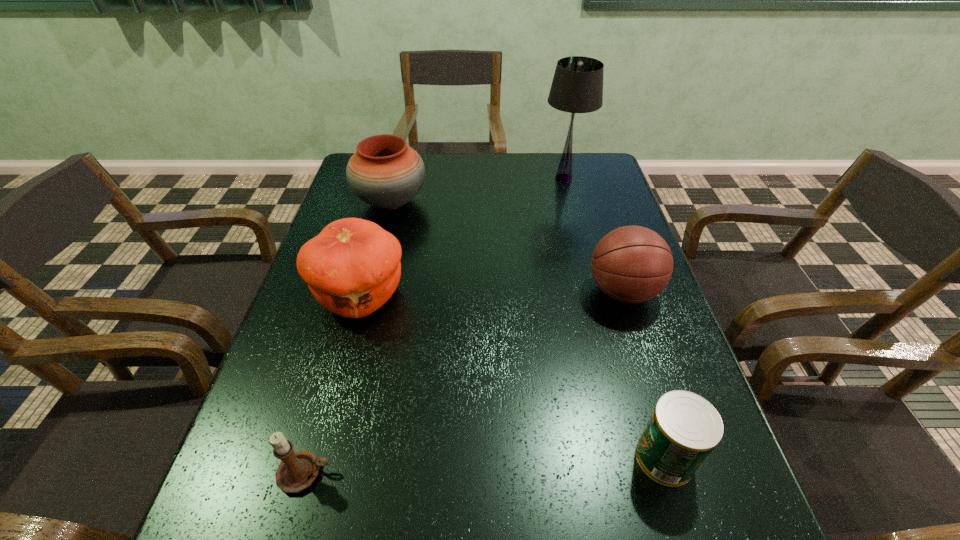
Locate an element on the screen. This screenshot has width=960, height=540. lampshade is located at coordinates (577, 87).

Where is `pumpkin`? The image size is (960, 540). pumpkin is located at coordinates (352, 268).

The height and width of the screenshot is (540, 960). What are the coordinates of `pottery` in the screenshot? It's located at point(384,172).

Image resolution: width=960 pixels, height=540 pixels. What are the coordinates of `basketball` in the screenshot? It's located at (631, 264).

Image resolution: width=960 pixels, height=540 pixels. I want to click on can, so click(x=684, y=428).

Where is `candle holder`? This screenshot has width=960, height=540. candle holder is located at coordinates (297, 470).

Identify the location of free spot located 0.400m on the front-facing side of the tallest object. (419, 178).

This screenshot has width=960, height=540. I want to click on free location located on the front-facing side of the tallest object, so click(x=485, y=178).

What are the coordinates of `vacant region located on the front-facing side of the tallest object` in the screenshot? It's located at (492, 178).

At what (x,y) coordinates should I click in order to perform the action: click on vacant area located on the front of the pumpkin. Please return your answer as a coordinate pair (x, y). This screenshot has width=960, height=540. Looking at the image, I should click on (303, 512).